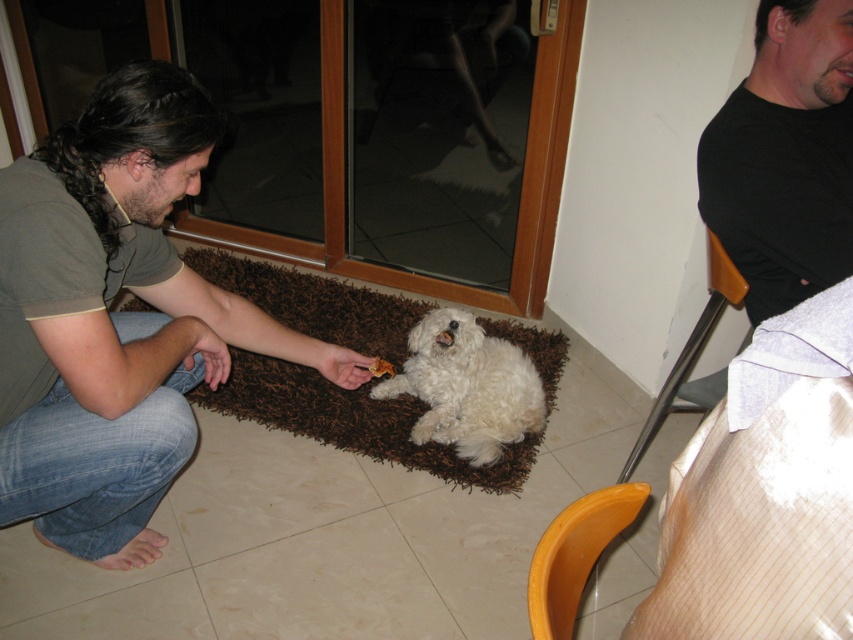
Can you confirm if transparent glass door at center is bigger than white fluffy dog at center?

Correct, transparent glass door at center is larger in size than white fluffy dog at center.

Is transparent glass door at center behind white fluffy dog at center?

Yes.

The image size is (853, 640). I want to click on transparent glass door at center, so click(x=520, y=198).

Can you confirm if black t-shirt at upper right is shorter than transparent glass door at center?

Correct, black t-shirt at upper right is not as tall as transparent glass door at center.

In the scene shown: Which is below, black t-shirt at upper right or transparent glass door at center?

black t-shirt at upper right is lower down.

You are a GUI agent. You are given a task and a screenshot of the screen. Output one action in this format:
    pyautogui.click(x=<x>, y=<y>)
    Task: Click on the black t-shirt at upper right
    The width and height of the screenshot is (853, 640).
    Given the screenshot: What is the action you would take?
    pyautogui.click(x=785, y=157)

Can you confirm if matte gray shirt at center is wider than black t-shirt at upper right?

Indeed, matte gray shirt at center has a greater width compared to black t-shirt at upper right.

The height and width of the screenshot is (640, 853). What do you see at coordinates (115, 317) in the screenshot?
I see `matte gray shirt at center` at bounding box center [115, 317].

At what (x,y) coordinates should I click in order to perform the action: click on matte gray shirt at center. Please return your answer as a coordinate pair (x, y). Looking at the image, I should click on (115, 317).

The height and width of the screenshot is (640, 853). What are the coordinates of `matte gray shirt at center` in the screenshot? It's located at (115, 317).